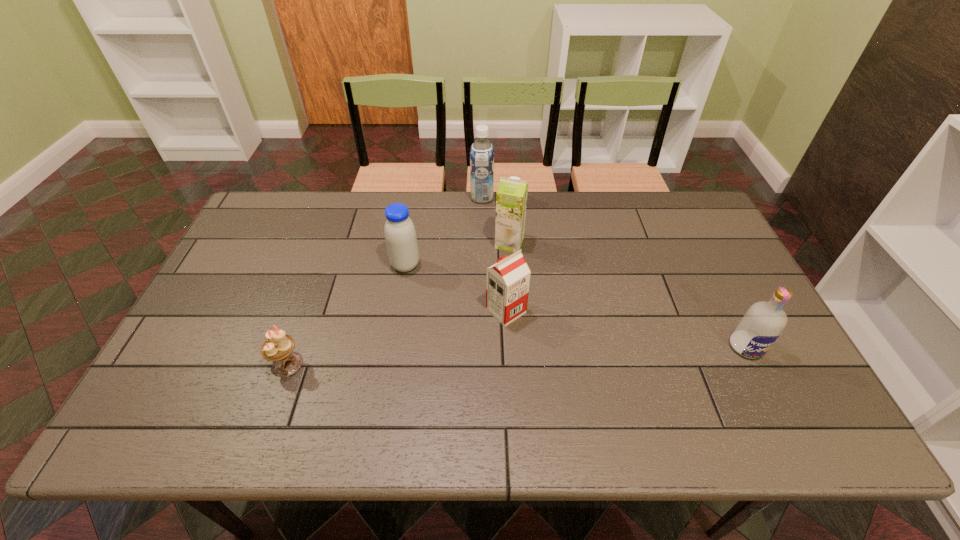
This screenshot has height=540, width=960. I want to click on blank region between the second farthest object and the second object from left to right, so click(x=457, y=254).

Identify which object is the fifth nearest to the nearest soya milk. Please provide its 2D coordinates. Your answer should be formatted as a tuple, i.e. [(x, y)], where the tuple contains the x and y coordinates of a point satisfying the conditions above.

[(760, 327)]

Select which object appears as the fifth closest to the leftmost object. Please provide its 2D coordinates. Your answer should be formatted as a tuple, i.e. [(x, y)], where the tuple contains the x and y coordinates of a point satisfying the conditions above.

[(760, 327)]

Identify which soya milk is located as the second nearest to the farthest soya milk. Please provide its 2D coordinates. Your answer should be formatted as a tuple, i.e. [(x, y)], where the tuple contains the x and y coordinates of a point satisfying the conditions above.

[(400, 235)]

At what (x,y) coordinates should I click in order to perform the action: click on soya milk that is the closest to the leftmost object. Please return your answer as a coordinate pair (x, y). The image size is (960, 540). Looking at the image, I should click on (400, 235).

Locate an element on the screen. The height and width of the screenshot is (540, 960). vacant region that satisfies the following two spatial constraints: 1. on the label of the fourth farthest object; 2. on the right side of the farthest object is located at coordinates (483, 311).

Find the location of a particular element. This screenshot has height=540, width=960. free space that satisfies the following two spatial constraints: 1. on the label of the nearest soya milk; 2. on the right side of the farthest soya milk is located at coordinates (483, 311).

In order to click on free space that satisfies the following two spatial constraints: 1. on the back side of the leftmost object; 2. on the left side of the fifth nearest object in this screenshot , I will do (330, 243).

At what (x,y) coordinates should I click in order to perform the action: click on free space in the image that satisfies the following two spatial constraints: 1. on the back side of the fifth nearest object; 2. on the label of the farthest object. Please return your answer as a coordinate pair (x, y). The height and width of the screenshot is (540, 960). Looking at the image, I should click on (506, 198).

Identify the location of vacant space that satisfies the following two spatial constraints: 1. on the label of the farthest soya milk; 2. on the back side of the nearest soya milk. The width and height of the screenshot is (960, 540). (483, 311).